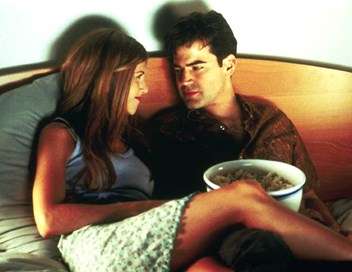
Find the location of `headboard`. headboard is located at coordinates (327, 127).